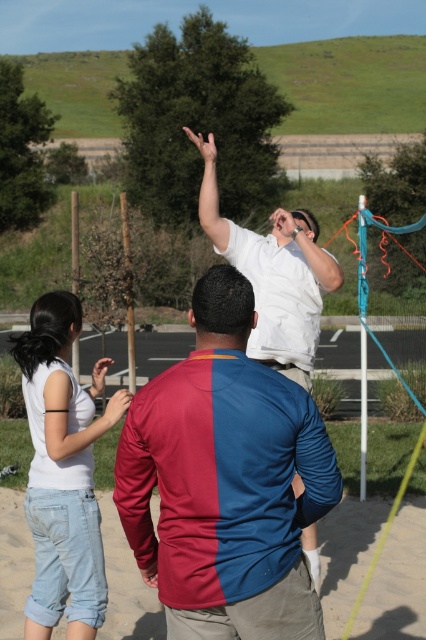
You are a photographer standing at the edge of the field. You want to take a photo that includes both the maroon and blue jersey at center and the brown sandy ground at lower center. Given their distance apart, will you need to adjust your camera to include both in the frame?

The maroon and blue jersey at center and brown sandy ground at lower center are 10.64 feet apart. To include both in the frame, you would need to adjust your camera to a wider angle or move closer to ensure the entire distance between them is captured.

You are a photographer trying to capture the scene of the volleyball game. You notice the light blue denim shorts at lower left and the brown sandy ground at lower center in your viewfinder. Which object should you zoom in on to fill the frame more effectively without moving the camera?

The light blue denim shorts at lower left is bigger than the brown sandy ground at lower center, so zooming in on the light blue denim shorts at lower left will fill the frame more effectively without moving the camera.